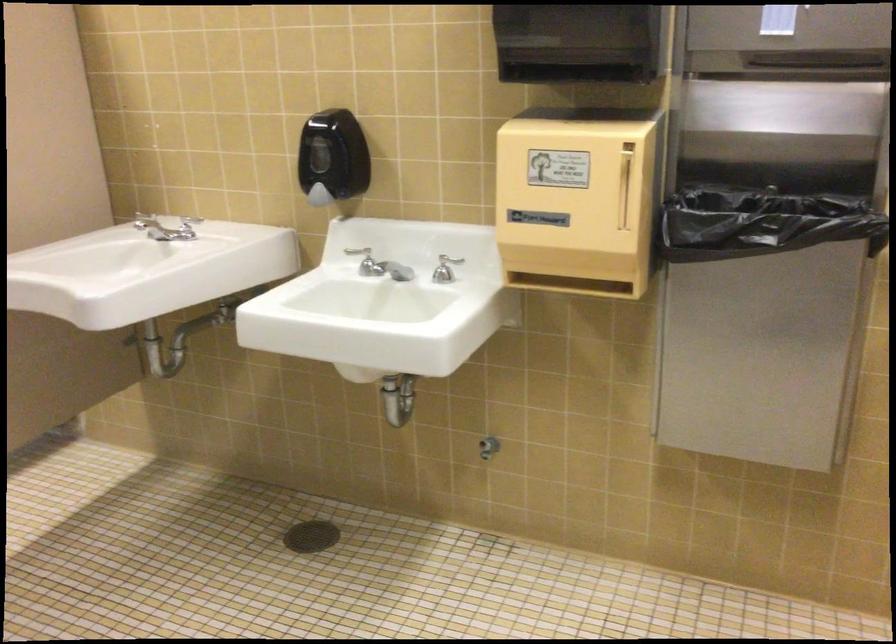
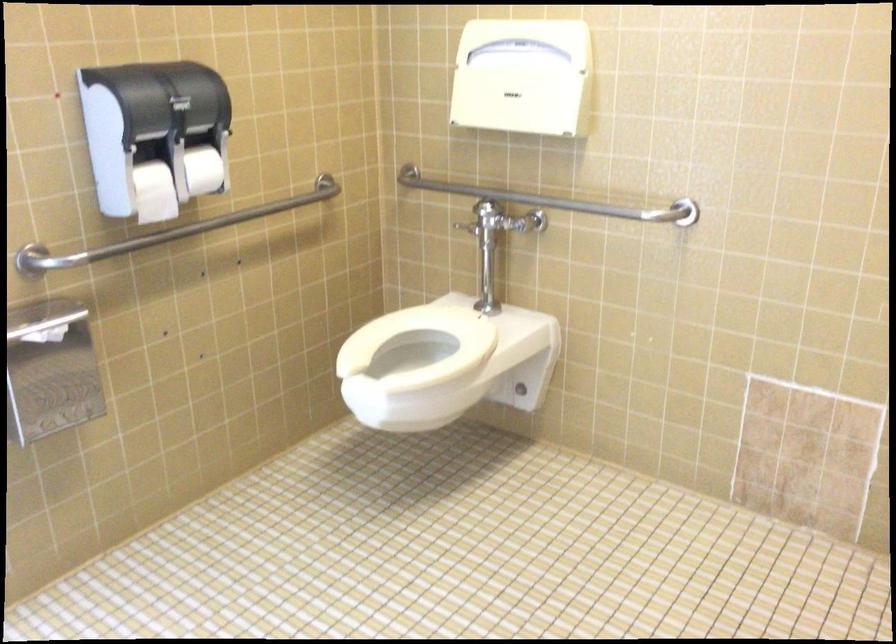
Question: The images are taken continuously from a first-person perspective. In which direction are you moving?

Choices:
 (A) Left
 (B) Right
 (C) Forward
 (D) Backward

Answer: (A)